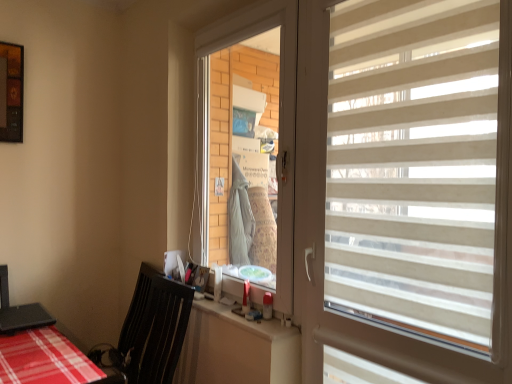
What do you see at coordinates (148, 333) in the screenshot? I see `black plastic swivel chair at lower left` at bounding box center [148, 333].

Locate an element on the screen. This screenshot has width=512, height=384. white plastic counter top at lower center is located at coordinates (247, 321).

At what (x,y) coordinates should I click in order to perform the action: click on transparent plastic window screen at center. Please return your answer as a coordinate pair (x, y). The height and width of the screenshot is (384, 512). Looking at the image, I should click on (279, 126).

Considering the sizes of objects white plastic counter top at lower center and transparent plastic window screen at center in the image provided, who is smaller, white plastic counter top at lower center or transparent plastic window screen at center?

white plastic counter top at lower center.

Is point (250, 322) behind point (282, 221)?

No, it is not.

From a real-world perspective, which is physically above, white plastic counter top at lower center or transparent plastic window screen at center?

transparent plastic window screen at center.

Consider the image. Visually, is white plastic counter top at lower center positioned to the left or to the right of beige striped window blind at right?

In the image, white plastic counter top at lower center appears on the left side of beige striped window blind at right.

Is white plastic counter top at lower center far away from beige striped window blind at right?

white plastic counter top at lower center is near beige striped window blind at right, not far away.

Could beige striped window blind at right be considered to be inside white plastic counter top at lower center?

That's incorrect, beige striped window blind at right is not inside white plastic counter top at lower center.

Considering the sizes of objects white plastic counter top at lower center and beige striped window blind at right in the image provided, who is taller, white plastic counter top at lower center or beige striped window blind at right?

With more height is beige striped window blind at right.

Considering the relative sizes of transparent plastic window screen at center and white plastic counter top at lower center in the image provided, is transparent plastic window screen at center bigger than white plastic counter top at lower center?

Yes.

Would you say transparent plastic window screen at center is a long distance from white plastic counter top at lower center?

Actually, transparent plastic window screen at center and white plastic counter top at lower center are a little close together.

Does transparent plastic window screen at center appear on the left side of white plastic counter top at lower center?

No.

Which object is further away from the camera taking this photo, transparent plastic window screen at center or white plastic counter top at lower center?

transparent plastic window screen at center.

Considering the sizes of objects black plastic swivel chair at lower left and transparent plastic window screen at center in the image provided, who is wider, black plastic swivel chair at lower left or transparent plastic window screen at center?

With larger width is black plastic swivel chair at lower left.

Is black plastic swivel chair at lower left not near transparent plastic window screen at center?

That's not correct — black plastic swivel chair at lower left is a little close to transparent plastic window screen at center.

This screenshot has width=512, height=384. I want to click on window screen located above the black plastic swivel chair at lower left (from the image's perspective), so click(x=279, y=126).

From the image's perspective, which object appears higher, transparent plastic window screen at center or black plastic swivel chair at lower left?

transparent plastic window screen at center appears higher in the image.

Is transparent plastic window screen at center inside or outside of black plastic swivel chair at lower left?

Answer: transparent plastic window screen at center is spatially situated outside black plastic swivel chair at lower left.

Is black plastic swivel chair at lower left at the back of transparent plastic window screen at center?

No, transparent plastic window screen at center is not facing away from black plastic swivel chair at lower left.

Does black plastic swivel chair at lower left turn towards white plastic counter top at lower center?

No, black plastic swivel chair at lower left is not turned towards white plastic counter top at lower center.

From a real-world perspective, is black plastic swivel chair at lower left physically located above or below white plastic counter top at lower center?

black plastic swivel chair at lower left is situated lower than white plastic counter top at lower center in the real world.

Between black plastic swivel chair at lower left and white plastic counter top at lower center, which one has smaller size?

Smaller between the two is white plastic counter top at lower center.

In the scene shown: What's the angular difference between black plastic swivel chair at lower left and white plastic counter top at lower center's facing directions?

The facing directions of black plastic swivel chair at lower left and white plastic counter top at lower center are 4.08 degrees apart.

How many degrees apart are the facing directions of beige striped window blind at right and white plastic counter top at lower center?

There is a 0.812-degree angle between the facing directions of beige striped window blind at right and white plastic counter top at lower center.

In terms of width, does beige striped window blind at right look wider or thinner when compared to white plastic counter top at lower center?

In the image, beige striped window blind at right appears to be more narrow than white plastic counter top at lower center.

Is beige striped window blind at right oriented away from white plastic counter top at lower center?

No, beige striped window blind at right is not facing away from white plastic counter top at lower center.

Considering the sizes of objects beige striped window blind at right and white plastic counter top at lower center in the image provided, who is bigger, beige striped window blind at right or white plastic counter top at lower center?

With larger size is beige striped window blind at right.

In the image, there is a transparent plastic window screen at center. Find the location of `counter top below it (from the image's perspective)`. counter top below it (from the image's perspective) is located at coordinates (247, 321).

Find the location of a particular element. counter top on the left of beige striped window blind at right is located at coordinates (247, 321).

From the image, which object appears to be nearer to white plastic counter top at lower center, black plastic swivel chair at lower left or beige striped window blind at right?

Among the two, black plastic swivel chair at lower left is located nearer to white plastic counter top at lower center.

Which object lies nearer to the anchor point white plastic counter top at lower center, beige striped window blind at right or black plastic swivel chair at lower left?

Based on the image, black plastic swivel chair at lower left appears to be nearer to white plastic counter top at lower center.

From the image, which object appears to be farther from beige striped window blind at right, black plastic swivel chair at lower left or transparent plastic window screen at center?

Based on the image, black plastic swivel chair at lower left appears to be further to beige striped window blind at right.

Looking at the image, which one is located further to transparent plastic window screen at center, white plastic counter top at lower center or black plastic swivel chair at lower left?

Based on the image, black plastic swivel chair at lower left appears to be further to transparent plastic window screen at center.

Considering their positions, is beige striped window blind at right positioned further to white plastic counter top at lower center than transparent plastic window screen at center?

beige striped window blind at right is positioned further to the anchor white plastic counter top at lower center.

Consider the image. When comparing their distances from black plastic swivel chair at lower left, does white plastic counter top at lower center or transparent plastic window screen at center seem further?

Based on the image, transparent plastic window screen at center appears to be further to black plastic swivel chair at lower left.

Considering their positions, is transparent plastic window screen at center positioned closer to black plastic swivel chair at lower left than white plastic counter top at lower center?

white plastic counter top at lower center is positioned closer to the anchor black plastic swivel chair at lower left.

From the image, which object appears to be farther from black plastic swivel chair at lower left, white plastic counter top at lower center or beige striped window blind at right?

beige striped window blind at right lies further to black plastic swivel chair at lower left than the other object.

Identify the location of window blind between transparent plastic window screen at center and white plastic counter top at lower center in the up-down direction. The height and width of the screenshot is (384, 512). (413, 166).

This screenshot has width=512, height=384. I want to click on window screen between black plastic swivel chair at lower left and beige striped window blind at right in the horizontal direction, so click(279, 126).

Image resolution: width=512 pixels, height=384 pixels. I want to click on counter top situated between black plastic swivel chair at lower left and beige striped window blind at right from left to right, so click(247, 321).

Where is `counter top between transparent plastic window screen at center and black plastic swivel chair at lower left vertically`? The width and height of the screenshot is (512, 384). counter top between transparent plastic window screen at center and black plastic swivel chair at lower left vertically is located at coordinates (247, 321).